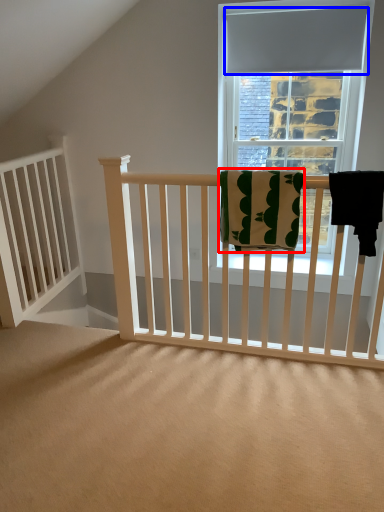
Question: Among these objects, which one is farthest to the camera, beach towel (highlighted by a red box) or curtain (highlighted by a blue box)?

Choices:
 (A) beach towel
 (B) curtain

Answer: (B)